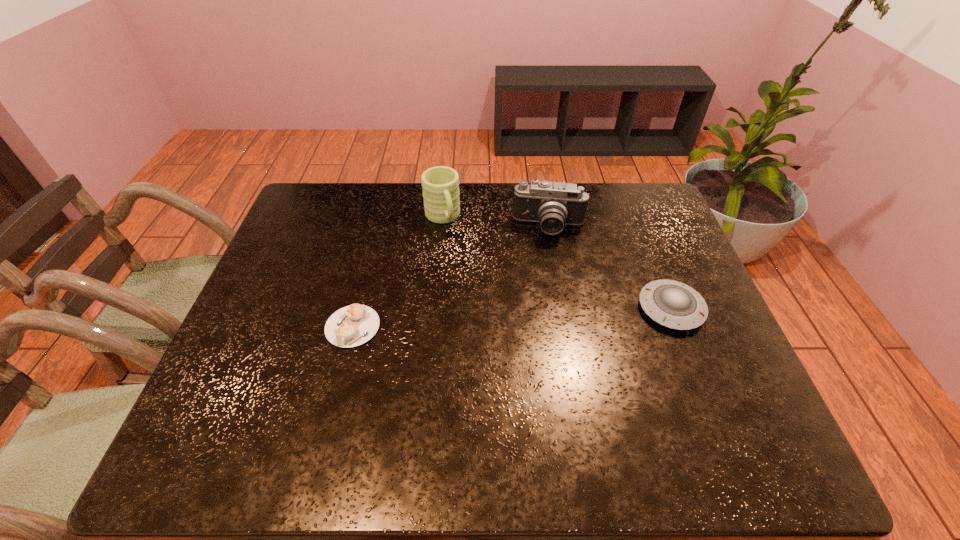
In the image, there is a desktop. Where is `free region at the far right corner`? The height and width of the screenshot is (540, 960). free region at the far right corner is located at coordinates (656, 191).

The width and height of the screenshot is (960, 540). Find the location of `unoccupied area between the mug and the cappuccino`. unoccupied area between the mug and the cappuccino is located at coordinates (397, 272).

Find the location of a particular element. This screenshot has height=540, width=960. vacant space that is in between the shortest object and the third tallest object is located at coordinates (512, 318).

Image resolution: width=960 pixels, height=540 pixels. Find the location of `vacant point located between the shortest object and the rightmost object`. vacant point located between the shortest object and the rightmost object is located at coordinates [512, 318].

Find the location of a particular element. The image size is (960, 540). free space between the second object from left to right and the rightmost object is located at coordinates (557, 263).

The image size is (960, 540). In order to click on vacant point located between the third object from right to left and the shortest object in this screenshot , I will do `click(397, 272)`.

The image size is (960, 540). I want to click on free space between the mug and the second object from right to left, so click(x=495, y=222).

Where is `vacant space in between the third tallest object and the shortest object`? The width and height of the screenshot is (960, 540). vacant space in between the third tallest object and the shortest object is located at coordinates (512, 318).

At what (x,y) coordinates should I click in order to perform the action: click on free space between the cappuccino and the third tallest object. Please return your answer as a coordinate pair (x, y). This screenshot has height=540, width=960. Looking at the image, I should click on (512, 318).

This screenshot has height=540, width=960. Identify the location of free spot between the third object from right to left and the shortest object. tap(397, 272).